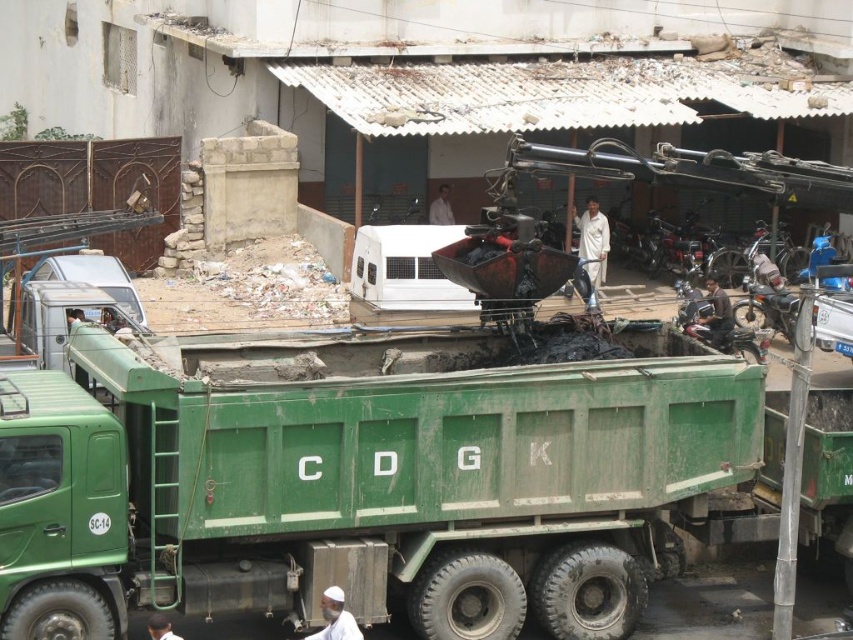
Can you confirm if white matte shirt at center is shorter than dark skin human at lower center?

Incorrect, white matte shirt at center's height does not fall short of dark skin human at lower center's.

This screenshot has height=640, width=853. What do you see at coordinates (440, 208) in the screenshot?
I see `white matte shirt at center` at bounding box center [440, 208].

The width and height of the screenshot is (853, 640). Describe the element at coordinates (440, 208) in the screenshot. I see `white matte shirt at center` at that location.

You are a GUI agent. You are given a task and a screenshot of the screen. Output one action in this format:
    pyautogui.click(x=<x>, y=<y>)
    Task: Click on the white matte shirt at center
    The width and height of the screenshot is (853, 640).
    Given the screenshot: What is the action you would take?
    tap(440, 208)

Can you confirm if green matte truck at center is positioned below white cotton shirt at center?

Correct, green matte truck at center is located below white cotton shirt at center.

Does green matte truck at center have a greater height compared to white cotton shirt at center?

Yes, green matte truck at center is taller than white cotton shirt at center.

What do you see at coordinates (360, 490) in the screenshot?
I see `green matte truck at center` at bounding box center [360, 490].

Find the location of a particular element. The image size is (853, 640). green matte truck at center is located at coordinates (360, 490).

Is white cloth at lower center bigger than light brown leather jacket at center?

Incorrect, white cloth at lower center is not larger than light brown leather jacket at center.

Between white cloth at lower center and light brown leather jacket at center, which one appears on the right side from the viewer's perspective?

Positioned to the right is light brown leather jacket at center.

Is point (339, 627) closer to viewer compared to point (773, 275)?

Yes, it is.

I want to click on white cloth at lower center, so click(335, 618).